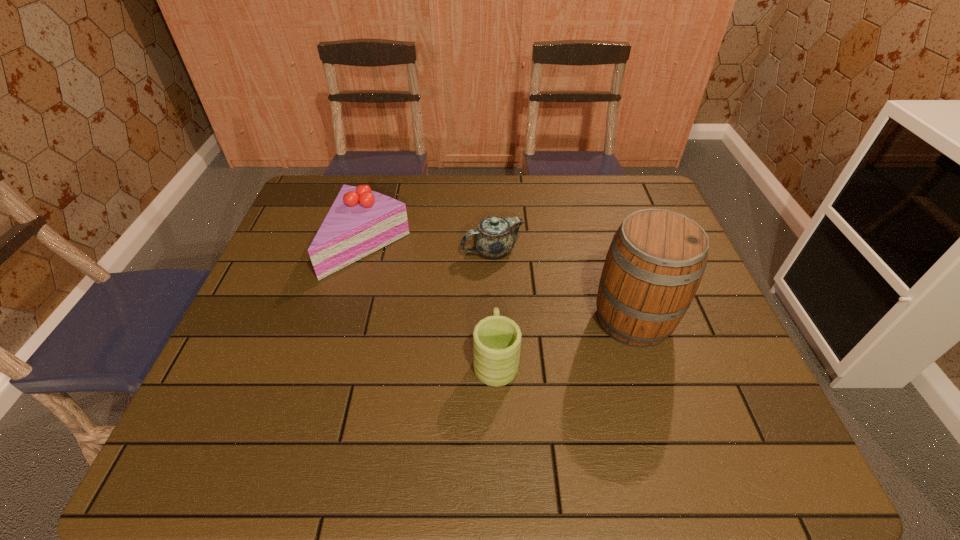
Locate an element on the screen. free space between the chinaware and the cider is located at coordinates (563, 285).

Identify the location of free area in between the cider and the cake. This screenshot has width=960, height=540. (501, 282).

The image size is (960, 540). Find the location of `vacant region between the chinaware and the mug`. vacant region between the chinaware and the mug is located at coordinates (493, 305).

Identify the location of object that is the closest one to the leftmost object. (495, 237).

Identify the location of the third closest object relative to the mug. (360, 221).

The height and width of the screenshot is (540, 960). I want to click on vacant region that satisfies the following two spatial constraints: 1. on the side of the rightmost object with the handle; 2. on the right side of the mug, so click(494, 320).

The image size is (960, 540). I want to click on vacant region that satisfies the following two spatial constraints: 1. from the spout of the chinaware; 2. on the left side of the rightmost object, so click(x=494, y=320).

The height and width of the screenshot is (540, 960). I want to click on free point that satisfies the following two spatial constraints: 1. on the side of the mug with the handle; 2. on the right side of the tallest object, so click(494, 320).

Image resolution: width=960 pixels, height=540 pixels. Identify the location of vacant space that satisfies the following two spatial constraints: 1. on the side of the mug with the handle; 2. on the left side of the tallest object. (494, 320).

Identify the location of free location that satisfies the following two spatial constraints: 1. from the spout of the rightmost object; 2. on the left side of the chinaware. (494, 320).